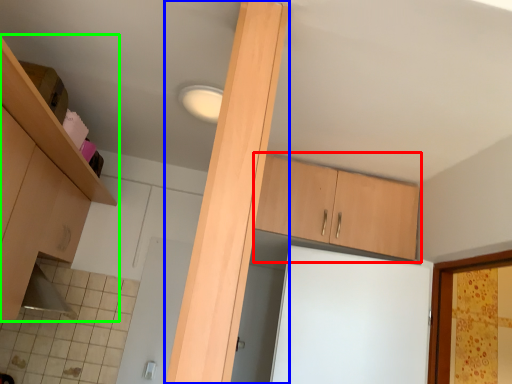
Question: Which is farther away from cabinetry (highlighted by a red box)? beam (highlighted by a blue box) or cabinetry (highlighted by a green box)?

Choices:
 (A) beam
 (B) cabinetry

Answer: (A)